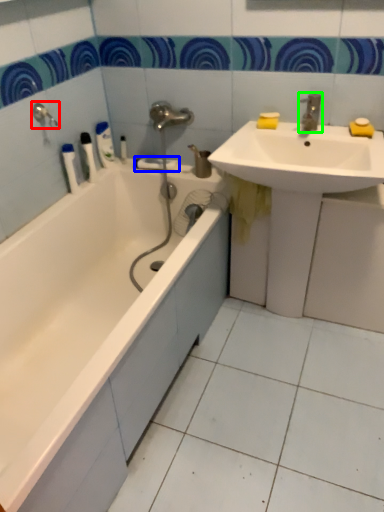
Question: Based on their relative distances, which object is farther from shower (highlighted by a red box)? Choose from towel bar (highlighted by a blue box) and tap (highlighted by a green box).

Choices:
 (A) towel bar
 (B) tap

Answer: (B)